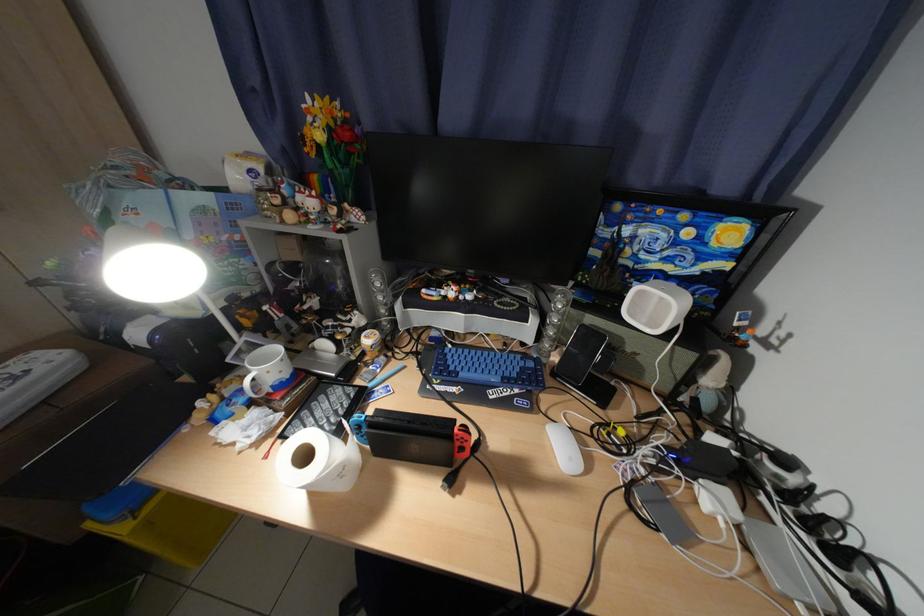
Where is `white mug handle`? white mug handle is located at coordinates (257, 381).